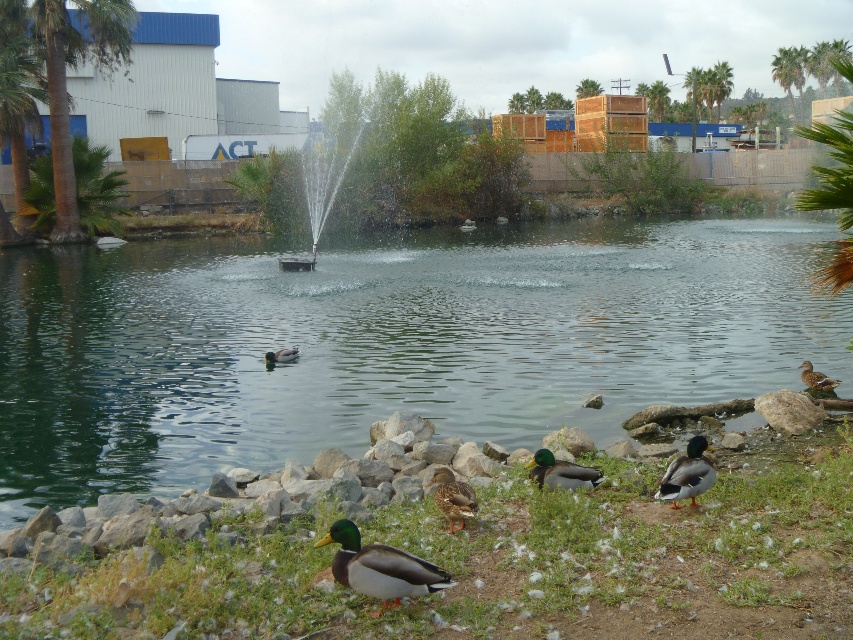
Can you confirm if green leafy palm tree at upper right is taller than green glossy duck at center?

Indeed, green leafy palm tree at upper right has a greater height compared to green glossy duck at center.

You are a GUI agent. You are given a task and a screenshot of the screen. Output one action in this format:
    pyautogui.click(x=<x>, y=<y>)
    Task: Click on the green leafy palm tree at upper right
    The width and height of the screenshot is (853, 640).
    Given the screenshot: What is the action you would take?
    pyautogui.click(x=788, y=72)

Who is shorter, clear water at center or green matte duck at lower right?

green matte duck at lower right is shorter.

Can you confirm if clear water at center is positioned to the left of green matte duck at lower right?

Yes, clear water at center is to the left of green matte duck at lower right.

What do you see at coordinates (387, 342) in the screenshot? I see `clear water at center` at bounding box center [387, 342].

Image resolution: width=853 pixels, height=640 pixels. I want to click on clear water at center, so click(387, 342).

Who is lower down, green leafy palm tree at left or green matte duck at lower right?

green matte duck at lower right

The image size is (853, 640). Find the location of `green leafy palm tree at left`. green leafy palm tree at left is located at coordinates (96, 188).